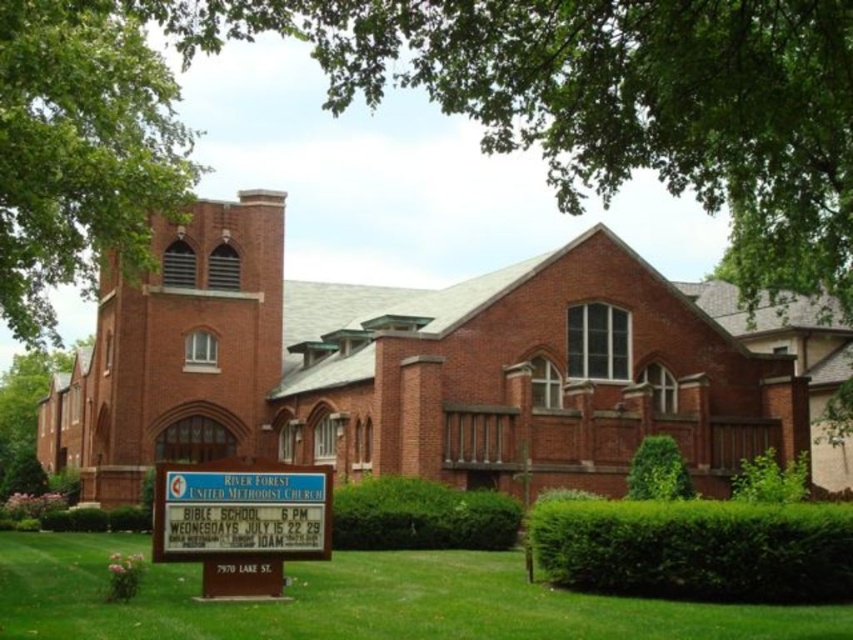
Between brick church at center and green grass at lower center, which one has less height?

green grass at lower center

Which is behind, point (505, 355) or point (102, 579)?

The point (505, 355) is more distant.

The width and height of the screenshot is (853, 640). I want to click on brick church at center, so click(x=408, y=369).

Describe the element at coordinates (695, 548) in the screenshot. I see `green leafy hedge at lower right` at that location.

Can you confirm if green leafy hedge at lower right is shorter than white plastic sign at lower center?

Correct, green leafy hedge at lower right is not as tall as white plastic sign at lower center.

Which is in front, point (668, 516) or point (244, 561)?

Positioned in front is point (244, 561).

At what (x,y) coordinates should I click in order to perform the action: click on green leafy hedge at lower right. Please return your answer as a coordinate pair (x, y). The width and height of the screenshot is (853, 640). Looking at the image, I should click on (695, 548).

Which is more to the left, green leafy tree at upper left or green leafy hedge at center?

From the viewer's perspective, green leafy tree at upper left appears more on the left side.

Identify the location of green leafy tree at upper left. This screenshot has width=853, height=640. (80, 148).

This screenshot has height=640, width=853. Find the location of `green leafy tree at upper left`. green leafy tree at upper left is located at coordinates (80, 148).

Where is `green leafy tree at upper left`? The width and height of the screenshot is (853, 640). green leafy tree at upper left is located at coordinates (80, 148).